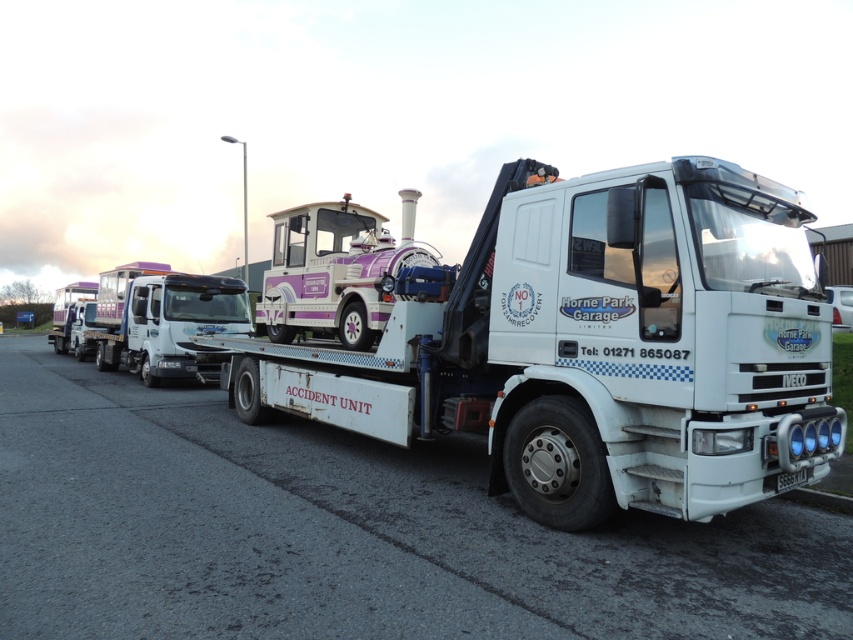
Can you confirm if white glossy truck at center is positioned to the left of black plastic license plate at center?

Correct, you'll find white glossy truck at center to the left of black plastic license plate at center.

Does white glossy truck at center have a greater height compared to black plastic license plate at center?

Correct, white glossy truck at center is much taller as black plastic license plate at center.

This screenshot has height=640, width=853. Describe the element at coordinates (165, 321) in the screenshot. I see `white glossy truck at center` at that location.

This screenshot has height=640, width=853. What are the coordinates of `white glossy truck at center` in the screenshot? It's located at (165, 321).

How far apart are purple glossy steam engine at center and black plastic license plate at center?

The distance of purple glossy steam engine at center from black plastic license plate at center is 5.07 meters.

Which is below, purple glossy steam engine at center or black plastic license plate at center?

Positioned lower is black plastic license plate at center.

Which is behind, point (326, 250) or point (804, 474)?

The point (326, 250) is behind.

At what (x,y) coordinates should I click in order to perform the action: click on purple glossy steam engine at center. Please return your answer as a coordinate pair (x, y). Looking at the image, I should click on (335, 269).

Which is in front, point (416, 195) or point (164, 332)?

Positioned in front is point (416, 195).

Does purple glossy steam engine at center have a larger size compared to white glossy truck at center?

No, purple glossy steam engine at center is not bigger than white glossy truck at center.

Is point (347, 332) less distant than point (155, 346)?

Yes, point (347, 332) is in front of point (155, 346).

Locate an element on the screen. The height and width of the screenshot is (640, 853). purple glossy steam engine at center is located at coordinates (335, 269).